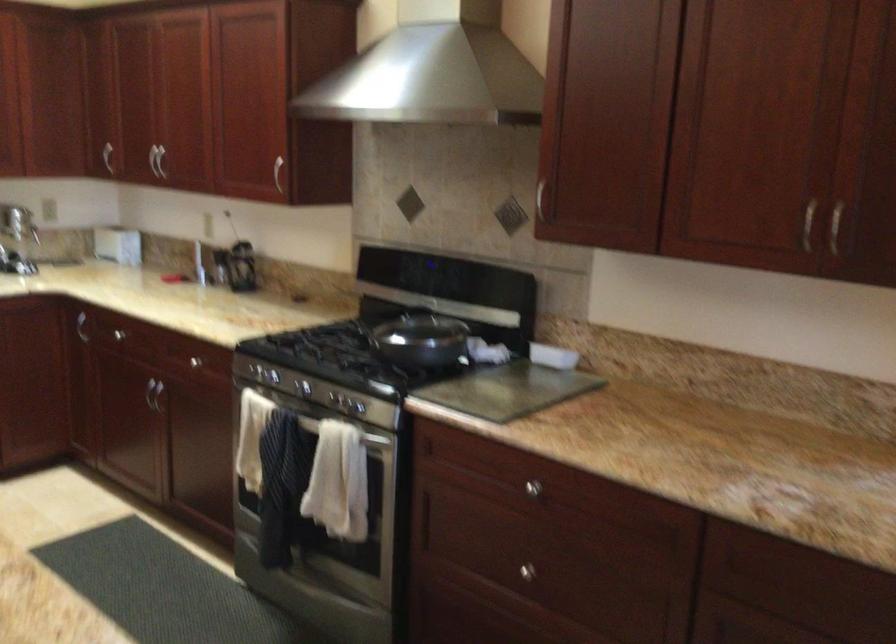
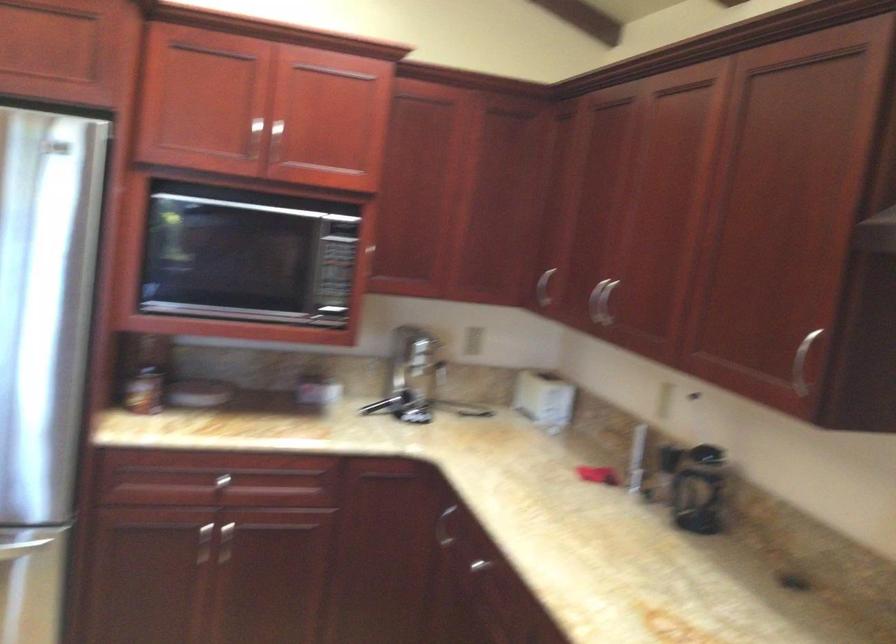
Find the pixel in the second image that matches [79,319] in the first image.

(444, 527)